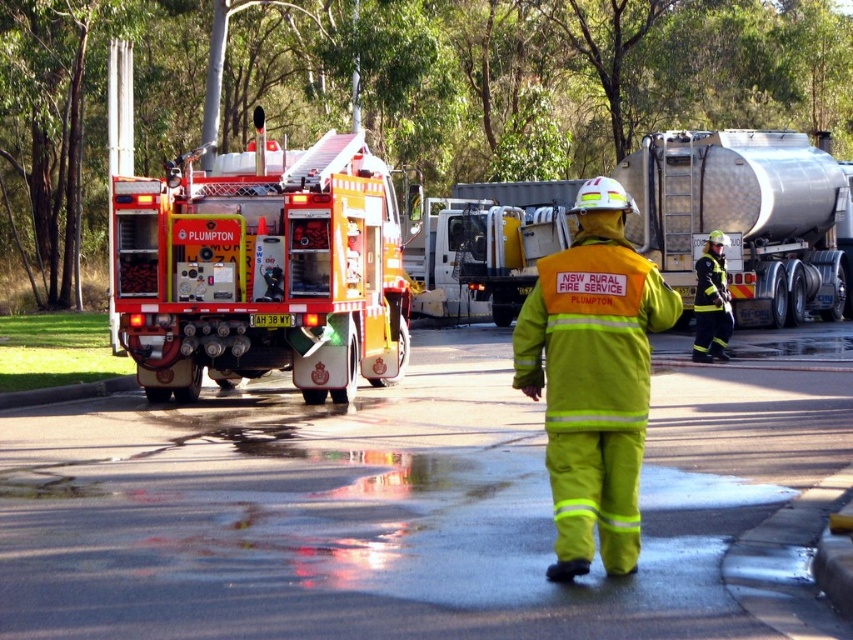
Consider the image. You are a firefighter in the NSW Rural Fire Service. You need to reach both the point at coordinates (268, 182) and the point at coordinates (608, 253). Which point should you reach first if you want to minimize the distance walked?

The point at coordinates (268, 182) is closer to you than the point at coordinates (608, 253), so you should reach it first to minimize the distance walked.

You are a drone operator tasked with capturing aerial footage of the NSW Rural Fire Service truck. The drone is currently hovering at the center of the scene. To ensure the polished silver trailer truck at upper right is in frame, in which direction should you move the drone?

The polished silver trailer truck at upper right is located at point 0.342 on the x axis and 0.877 on the y axis. Since the drone is at the center, moving it towards the upper right direction will bring the polished silver trailer truck at upper right into frame.

You are a photographer positioned at the edge of a rural area where the NSW Rural Fire Service is stationed. You want to take a photo that includes both the yellow reflective fire truck at center and the bright yellow reflective uniform at center. Which object should you focus on first to ensure both are in the frame without moving the camera?

You should focus on the bright yellow reflective uniform at center first since it is closer to you than the yellow reflective fire truck at center, which is further away. By focusing on the closer object, both will be in focus if they are within the camera focus range.